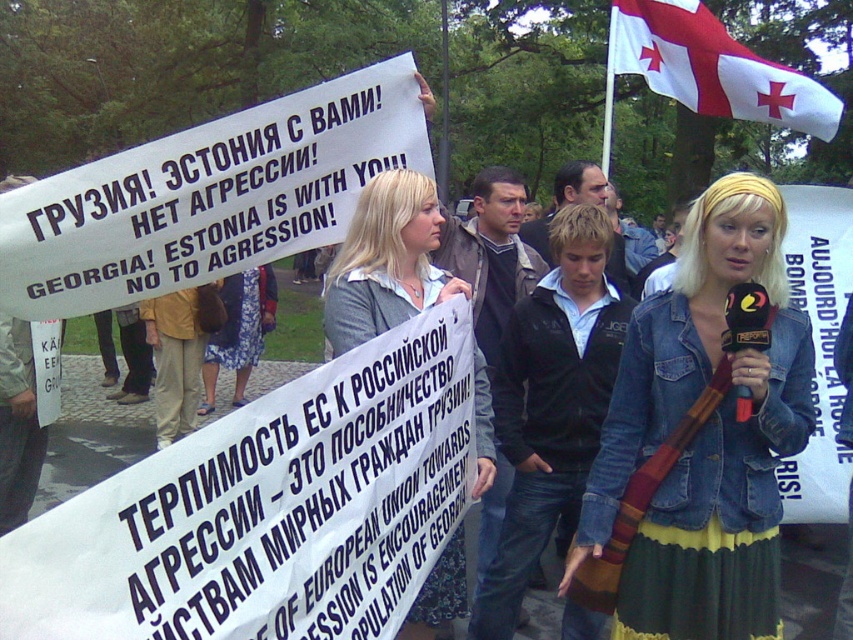
Question: Among these points, which one is farthest from the camera?

Choices:
 (A) (479, 472)
 (B) (474, 248)

Answer: (B)

Question: Does denim jacket at lower right appear over dark blue jacket at center?

Choices:
 (A) no
 (B) yes

Answer: (B)

Question: Is blonde hair at center to the left of dark blue jeans at center from the viewer's perspective?

Choices:
 (A) no
 (B) yes

Answer: (B)

Question: Does blonde hair at center appear over dark blue jeans at center?

Choices:
 (A) no
 (B) yes

Answer: (A)

Question: Which point is farther to the camera?

Choices:
 (A) (401, 273)
 (B) (543, 262)
 (C) (608, 106)

Answer: (C)

Question: Which point is farther to the camera?

Choices:
 (A) dark blue jeans at center
 (B) blonde hair at center
 (C) dark blue jacket at center

Answer: (C)